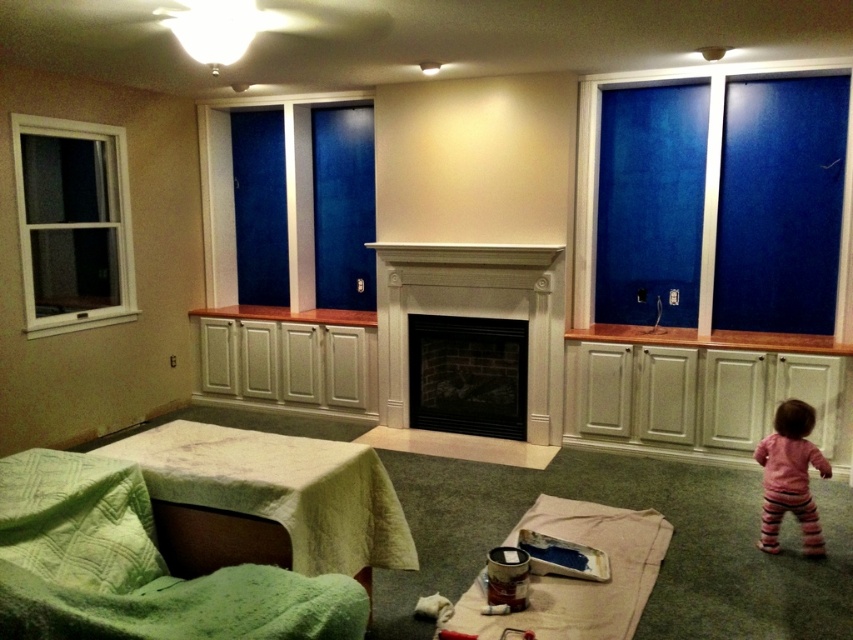
You are a painter who needs to place a ladder in the room. The ladder must be placed either next to the white wood fireplace at center or near the pink striped pants at lower right. Which location allows the ladder to be placed without obstructing the main pathway through the room?

The white wood fireplace at center has a larger size compared to pink striped pants at lower right, so placing the ladder near the pink striped pants at lower right would leave more space for the main pathway, thus not obstructing it.

You are standing in the center of the room and want to move to the black brick fireplace at center. In which direction should you move?

The black brick fireplace at center is located at point (467, 374), so you should move towards the center of the room to reach it.

You are standing in the room and want to place a 5 meter long sofa in the room. The sofa must be placed along the wall opposite to the white wood fireplace at center. Is there enough space for the sofa?

The white wood fireplace at center is 4.95 meters away from the camera. Since the sofa is 5 meters long, it would require a space slightly longer than the distance from the camera to the fireplace. Therefore, placing the 5 meter long sofa along the wall opposite to the white wood fireplace at center may not be feasible due to insufficient space.